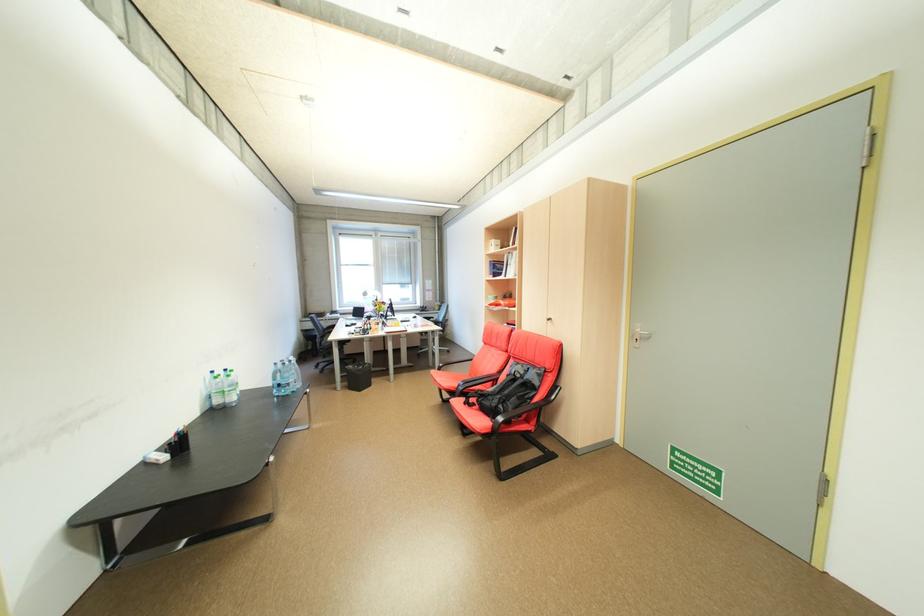
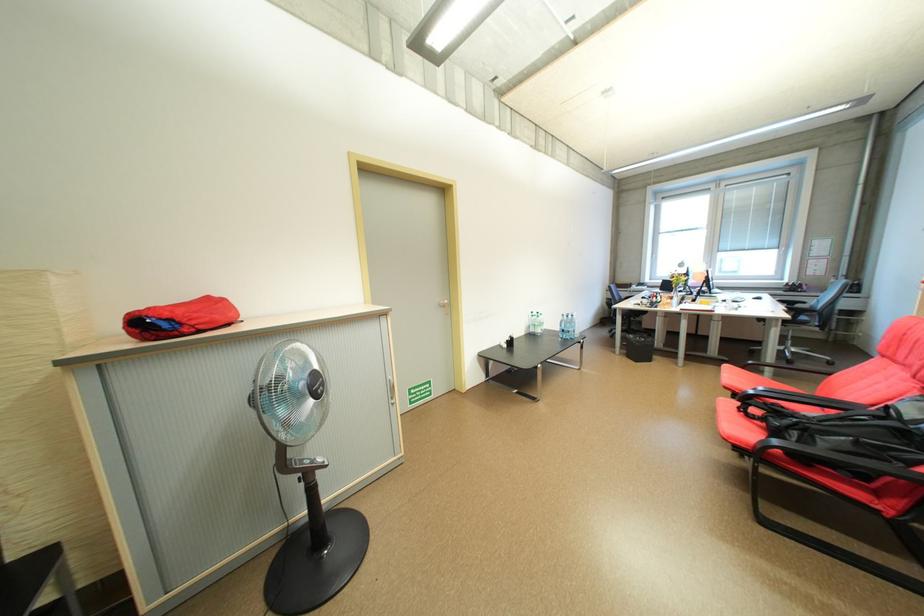
Question: The images are taken continuously from a first-person perspective. In which direction is your viewpoint rotating?

Choices:
 (A) Left
 (B) Right
 (C) Up
 (D) Down

Answer: (A)